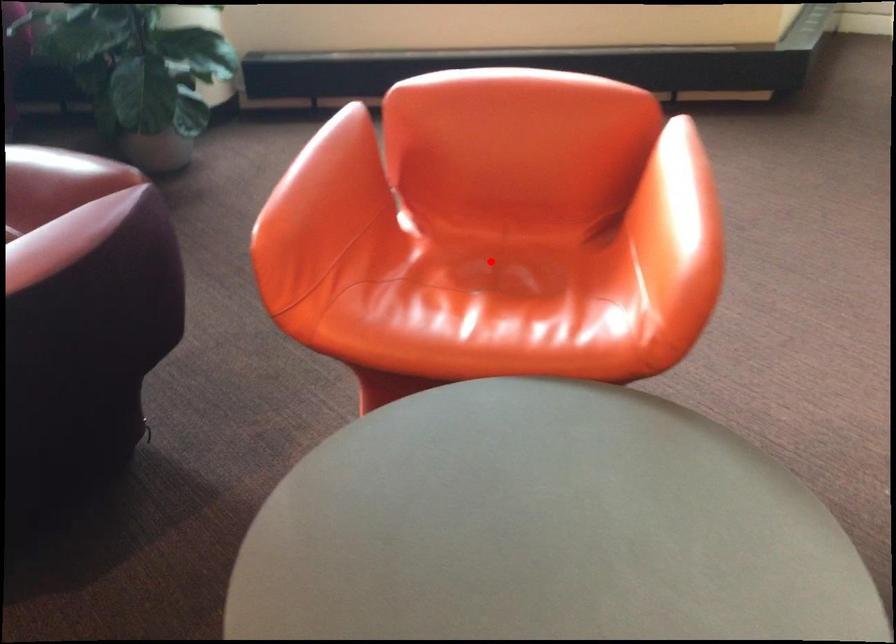
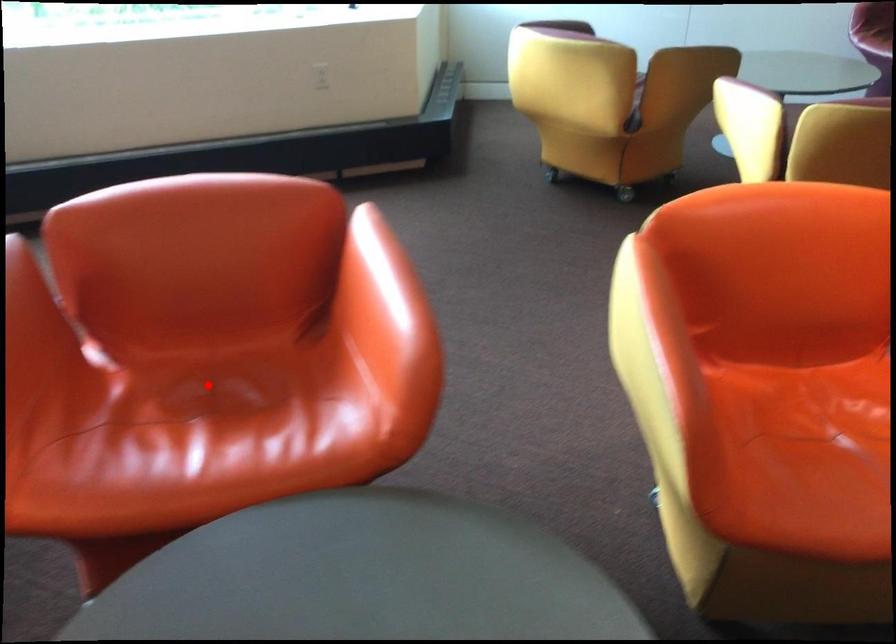
I am providing you with two images of the same scene from different viewpoints. A red point is marked on the first image and another point is marked on the second image. Does the point marked in image1 correspond to the same location as the one in image2?

Yes